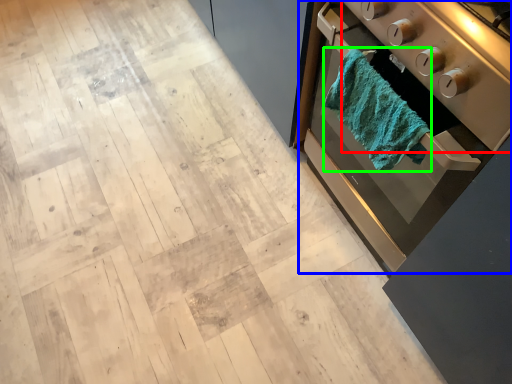
Question: Which object is the closest to the appliance (highlighted by a red box)? Choose among these: home appliance (highlighted by a blue box) or bath towel (highlighted by a green box).

Choices:
 (A) home appliance
 (B) bath towel

Answer: (B)